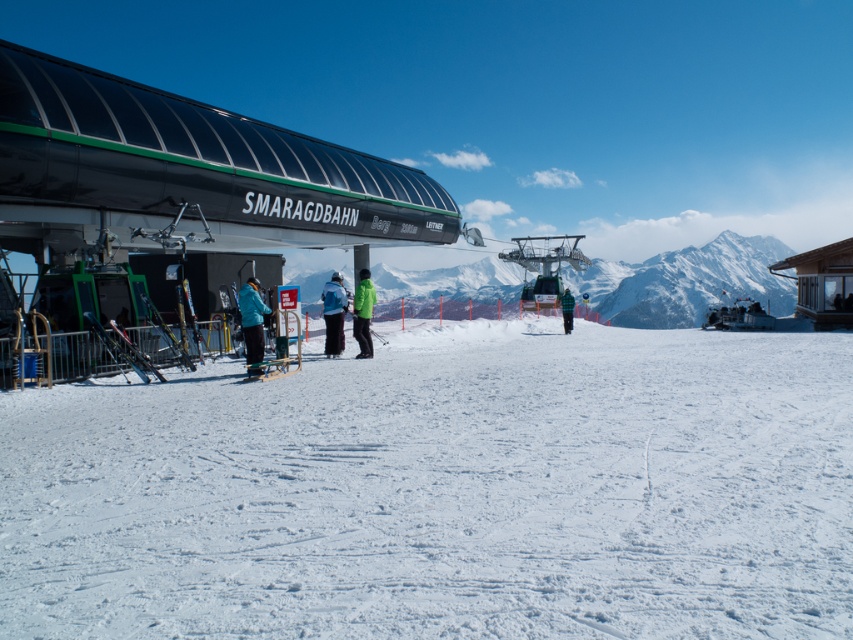
Question: Is green matte jacket at center to the right of metallic silver ski at lower left from the viewer's perspective?

Choices:
 (A) no
 (B) yes

Answer: (B)

Question: Considering the real-world distances, which object is farthest from the metallic silver ski at lower left?

Choices:
 (A) snowy white mountain at center
 (B) blue fabric jacket at center

Answer: (A)

Question: Is blue fabric jacket at center below metallic silver ski at lower left?

Choices:
 (A) yes
 (B) no

Answer: (B)

Question: Which point is closer to the camera?

Choices:
 (A) (253, 308)
 (B) (491, 284)
 (C) (415, 396)
 (D) (366, 300)

Answer: (C)

Question: Is green matte jacket at center further to the viewer compared to green checkered jacket at center?

Choices:
 (A) no
 (B) yes

Answer: (A)

Question: Among these points, which one is nearest to the camera?

Choices:
 (A) (563, 305)
 (B) (689, 528)
 (C) (366, 305)

Answer: (B)